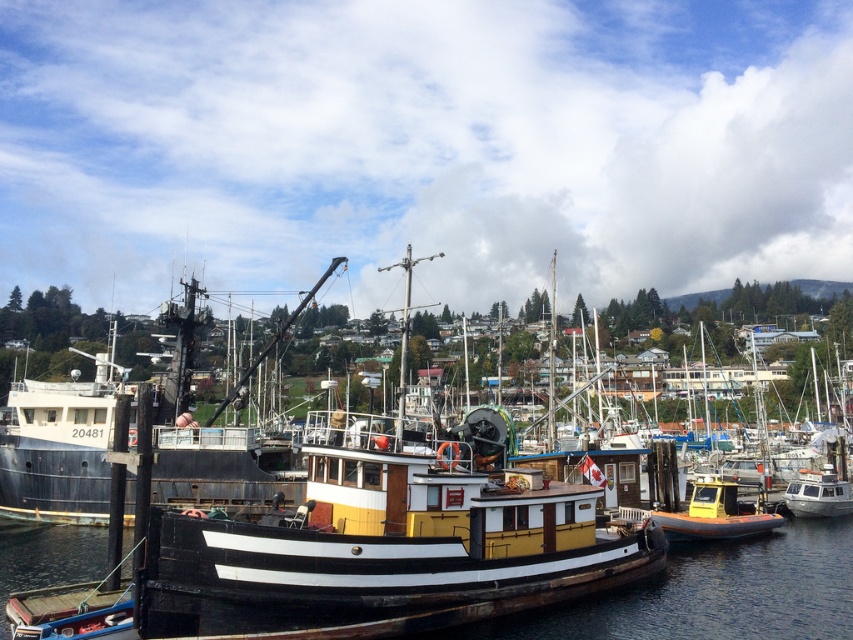
Question: Does yellow matte boat at center have a smaller size compared to black wood boat at center?

Choices:
 (A) no
 (B) yes

Answer: (A)

Question: Which object is closer to the camera taking this photo?

Choices:
 (A) yellow matte boat at center
 (B) black wood boat at center

Answer: (A)

Question: Which point is farther to the camera?

Choices:
 (A) black wood boat at center
 (B) yellow matte boat at center

Answer: (A)

Question: Considering the relative positions of yellow matte boat at center and black wood boat at center in the image provided, where is yellow matte boat at center located with respect to black wood boat at center?

Choices:
 (A) above
 (B) below

Answer: (A)

Question: Which point is farther to the camera?

Choices:
 (A) (71, 394)
 (B) (842, 621)

Answer: (A)

Question: Does yellow matte boat at center have a lesser width compared to black wood boat at center?

Choices:
 (A) no
 (B) yes

Answer: (A)